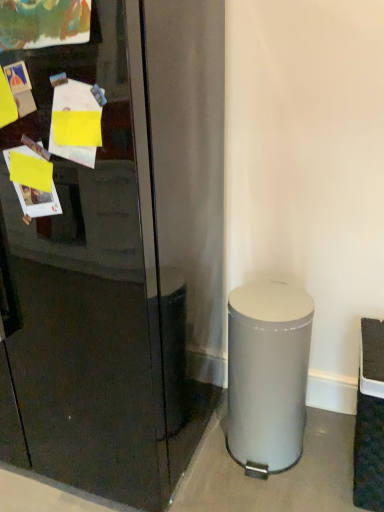
Question: Is silver metallic trash can at lower right situated inside glossy black refrigerator at center or outside?

Choices:
 (A) outside
 (B) inside

Answer: (A)

Question: In the image, is silver metallic trash can at lower right positioned in front of or behind glossy black refrigerator at center?

Choices:
 (A) front
 (B) behind

Answer: (B)

Question: Based on their sizes in the image, would you say silver metallic trash can at lower right is bigger or smaller than glossy black refrigerator at center?

Choices:
 (A) small
 (B) big

Answer: (A)

Question: In terms of height, does glossy black refrigerator at center look taller or shorter compared to silver metallic trash can at lower right?

Choices:
 (A) tall
 (B) short

Answer: (A)

Question: Considering the positions of glossy black refrigerator at center and silver metallic trash can at lower right in the image, is glossy black refrigerator at center wider or thinner than silver metallic trash can at lower right?

Choices:
 (A) thin
 (B) wide

Answer: (B)

Question: From a real-world perspective, is glossy black refrigerator at center positioned above or below silver metallic trash can at lower right?

Choices:
 (A) below
 (B) above

Answer: (B)

Question: Based on their sizes in the image, would you say glossy black refrigerator at center is bigger or smaller than silver metallic trash can at lower right?

Choices:
 (A) big
 (B) small

Answer: (A)